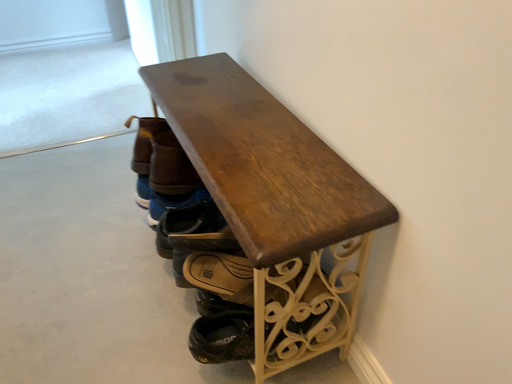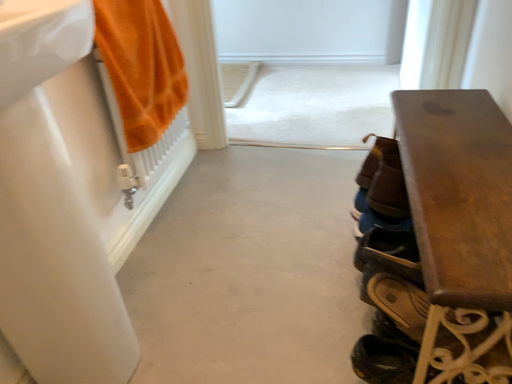
Question: Which way did the camera rotate in the video?

Choices:
 (A) rotated upward
 (B) rotated downward

Answer: (A)